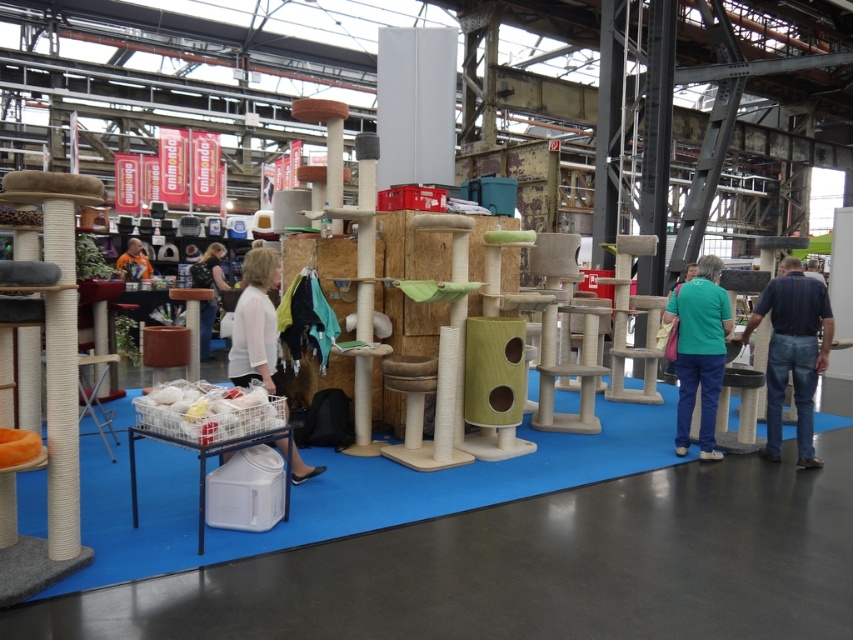
Does white fabric at center have a greater height compared to light brown hair at center?

No.

Who is more forward, [236,324] or [199,284]?

Point [236,324] is in front.

The height and width of the screenshot is (640, 853). Identify the location of white fabric at center. (254, 323).

Looking at this image, can you confirm if white fabric at center is thinner than orange fabric at center?

Indeed, white fabric at center has a lesser width compared to orange fabric at center.

Where is `white fabric at center`? white fabric at center is located at coordinates (254, 323).

Between point (247, 300) and point (138, 240), which one is positioned behind?

The point (138, 240) is behind.

You are a GUI agent. You are given a task and a screenshot of the screen. Output one action in this format:
    pyautogui.click(x=<x>, y=<y>)
    Task: Click on the white fabric at center
    
    Given the screenshot: What is the action you would take?
    pyautogui.click(x=254, y=323)

Is point (207, 314) positioned before point (685, 280)?

No, it is behind (685, 280).

Which is behind, point (213, 289) or point (682, 282)?

The point (682, 282) is behind.

Which is behind, point (206, 250) or point (685, 278)?

Point (206, 250)

Where is `light brown hair at center`? The image size is (853, 640). light brown hair at center is located at coordinates (207, 288).